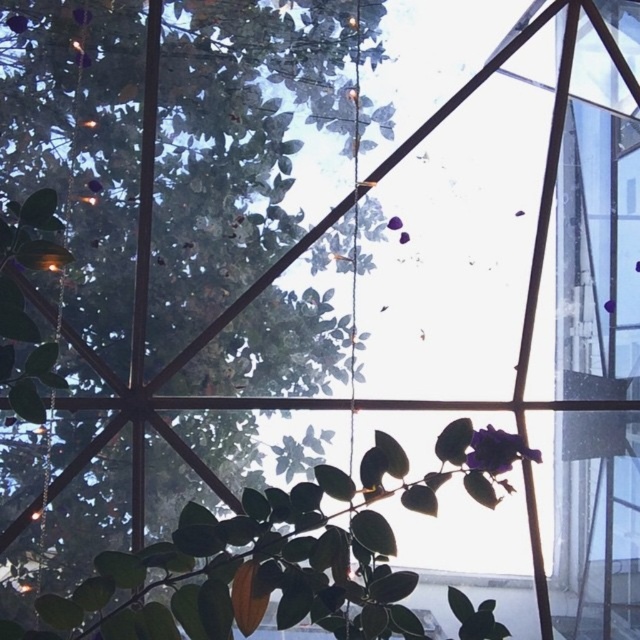
Question: Does green leafy tree at center lie behind green matte leafy plant at lower center?

Choices:
 (A) yes
 (B) no

Answer: (A)

Question: Among these points, which one is farthest from the camera?

Choices:
 (A) (332, 109)
 (B) (600, 209)
 (C) (330, 618)
 (D) (513, 449)

Answer: (B)

Question: Is green leafy tree at center wider than purple matte flower at lower right?

Choices:
 (A) no
 (B) yes

Answer: (B)

Question: Which point appears closest to the camera in this image?

Choices:
 (A) (387, 557)
 (B) (636, 330)

Answer: (A)

Question: Is green matte leafy plant at lower center wider than transparent glass window at right?

Choices:
 (A) yes
 (B) no

Answer: (A)

Question: Considering the real-world distances, which object is farthest from the purple matte flower at lower right?

Choices:
 (A) green matte leafy plant at lower center
 (B) transparent glass window at right
 (C) green leafy tree at center

Answer: (B)